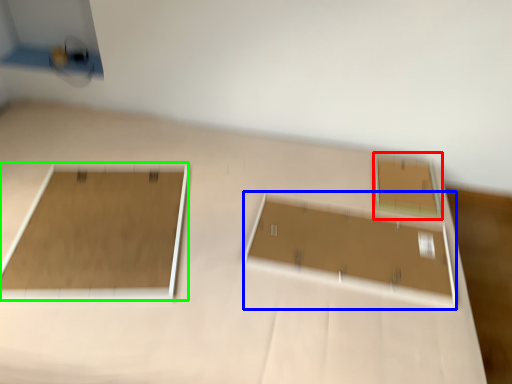
Question: Which object is positioned closest to rectangle (highlighted by a red box)? Select from rectangle (highlighted by a blue box) and rectangle (highlighted by a green box).

Choices:
 (A) rectangle
 (B) rectangle

Answer: (A)